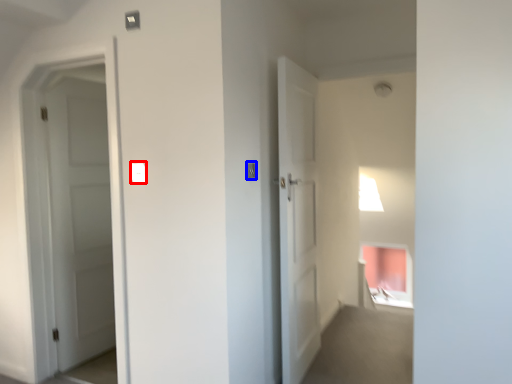
Question: Which object appears closest to the camera in this image, light switch (highlighted by a red box) or light switch (highlighted by a blue box)?

Choices:
 (A) light switch
 (B) light switch

Answer: (A)